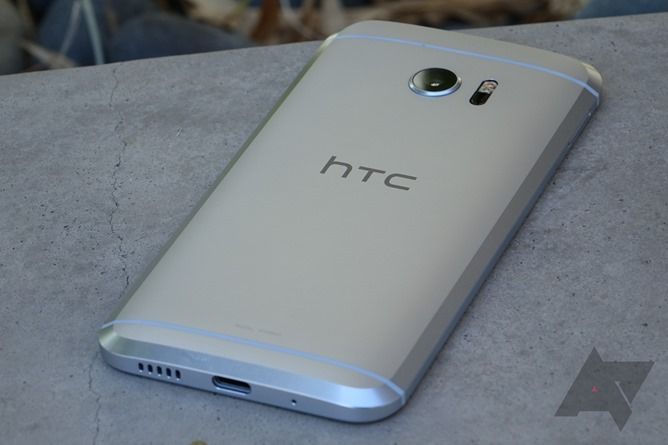
The image size is (668, 445). In order to click on phone plug in in this screenshot , I will do `click(230, 383)`.